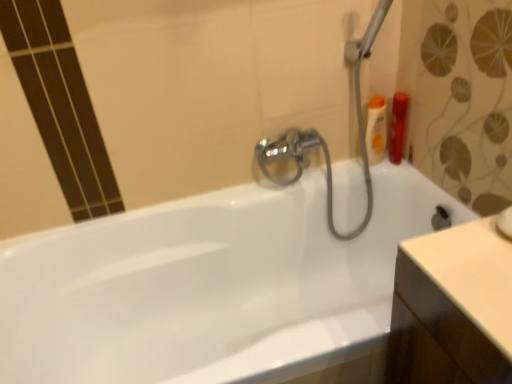
Question: Considering the relative positions of matte orange bottle at upper right, arranged as the first toiletry when viewed from the right, and translucent orange bottle at upper right, which ranks as the second toiletry in right-to-left order, in the image provided, is matte orange bottle at upper right, arranged as the first toiletry when viewed from the right, to the right of translucent orange bottle at upper right, which ranks as the second toiletry in right-to-left order, from the viewer's perspective?

Choices:
 (A) no
 (B) yes

Answer: (B)

Question: From a real-world perspective, is matte orange bottle at upper right, which ranks as the 2th toiletry in left-to-right order, physically above translucent orange bottle at upper right, which ranks as the second toiletry in right-to-left order?

Choices:
 (A) no
 (B) yes

Answer: (A)

Question: Is matte orange bottle at upper right, arranged as the first toiletry when viewed from the right, smaller than translucent orange bottle at upper right, the 1th toiletry in the left-to-right sequence?

Choices:
 (A) yes
 (B) no

Answer: (A)

Question: Considering the relative sizes of matte orange bottle at upper right, which ranks as the 2th toiletry in left-to-right order, and translucent orange bottle at upper right, which ranks as the second toiletry in right-to-left order, in the image provided, is matte orange bottle at upper right, which ranks as the 2th toiletry in left-to-right order, shorter than translucent orange bottle at upper right, which ranks as the second toiletry in right-to-left order,?

Choices:
 (A) yes
 (B) no

Answer: (A)

Question: Does matte orange bottle at upper right, arranged as the first toiletry when viewed from the right, have a lesser width compared to translucent orange bottle at upper right, the 1th toiletry in the left-to-right sequence?

Choices:
 (A) no
 (B) yes

Answer: (A)

Question: Is matte orange bottle at upper right, which ranks as the 2th toiletry in left-to-right order, in contact with translucent orange bottle at upper right, the 1th toiletry in the left-to-right sequence?

Choices:
 (A) no
 (B) yes

Answer: (B)

Question: Is matte orange bottle at upper right, arranged as the first toiletry when viewed from the right, shorter than white glossy bathtub at center?

Choices:
 (A) yes
 (B) no

Answer: (A)

Question: Is white glossy bathtub at center completely or partially inside matte orange bottle at upper right, which ranks as the 2th toiletry in left-to-right order?

Choices:
 (A) yes
 (B) no

Answer: (B)

Question: Is matte orange bottle at upper right, arranged as the first toiletry when viewed from the right, positioned with its back to white glossy bathtub at center?

Choices:
 (A) no
 (B) yes

Answer: (A)

Question: Does matte orange bottle at upper right, which ranks as the 2th toiletry in left-to-right order, come behind white glossy bathtub at center?

Choices:
 (A) no
 (B) yes

Answer: (B)

Question: From the image's perspective, does matte orange bottle at upper right, which ranks as the 2th toiletry in left-to-right order, appear lower than white glossy bathtub at center?

Choices:
 (A) no
 (B) yes

Answer: (A)

Question: Does matte orange bottle at upper right, which ranks as the 2th toiletry in left-to-right order, have a lesser width compared to white glossy bathtub at center?

Choices:
 (A) no
 (B) yes

Answer: (B)

Question: From the image's perspective, does white glossy bathtub at center appear higher than matte orange bottle at upper right, which ranks as the 2th toiletry in left-to-right order?

Choices:
 (A) yes
 (B) no

Answer: (B)